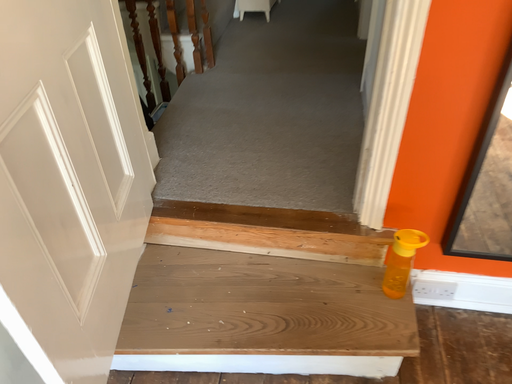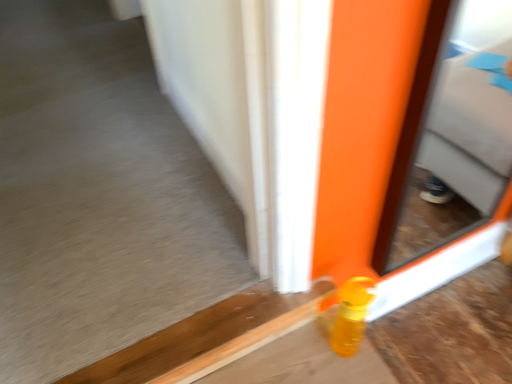
Question: Which way did the camera rotate in the video?

Choices:
 (A) rotated left
 (B) rotated right

Answer: (B)